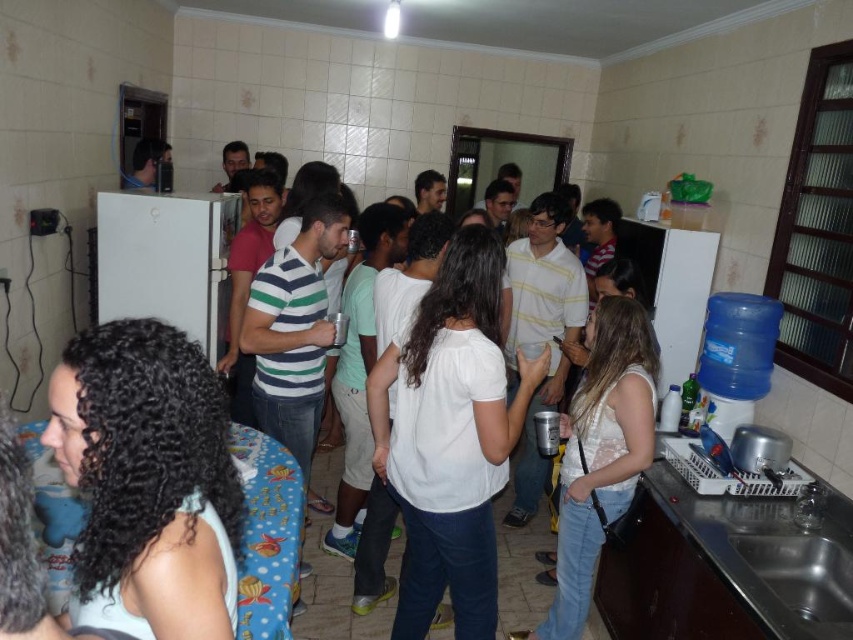
Which is more to the left, curly hair at center or white cotton shirt at center?

curly hair at center is more to the left.

Who is more distant from viewer, (210, 472) or (428, 573)?

Point (428, 573)

Identify the location of curly hair at center. (148, 481).

Between point (170, 556) and point (607, 472), which one is positioned behind?

The point (607, 472) is more distant.

Who is more forward, (83, 602) or (628, 348)?

Point (83, 602)

Identify the location of curly hair at center. point(148,481).

Measure the distance between point [422,620] and camera.

Point [422,620] is 2.29 meters away from camera.

Can you confirm if white cotton shirt at center is smaller than white lace top at center?

No, white cotton shirt at center is not smaller than white lace top at center.

The height and width of the screenshot is (640, 853). Describe the element at coordinates (450, 436) in the screenshot. I see `white cotton shirt at center` at that location.

Find the location of a particular element. This screenshot has height=640, width=853. white cotton shirt at center is located at coordinates (450, 436).